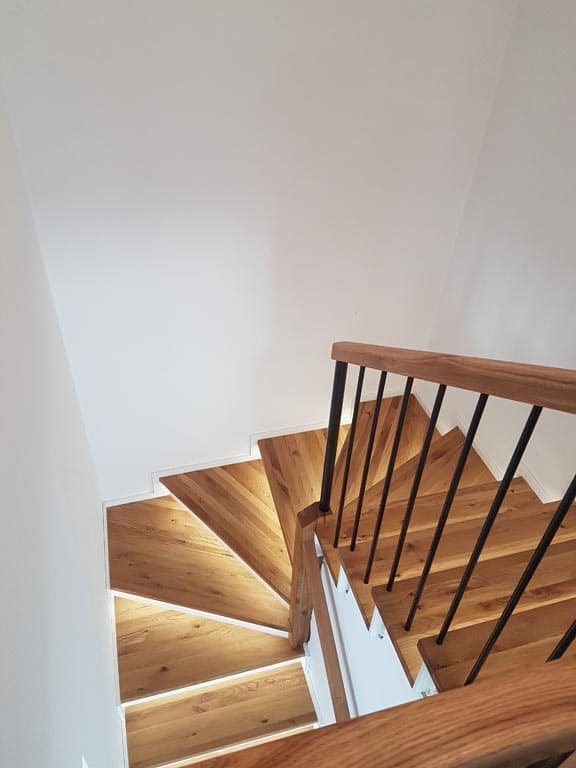
Where is `stairwell bannister rods`? stairwell bannister rods is located at coordinates (332, 439), (346, 448), (367, 455), (386, 464), (416, 475), (450, 488), (492, 504), (540, 541), (564, 636).